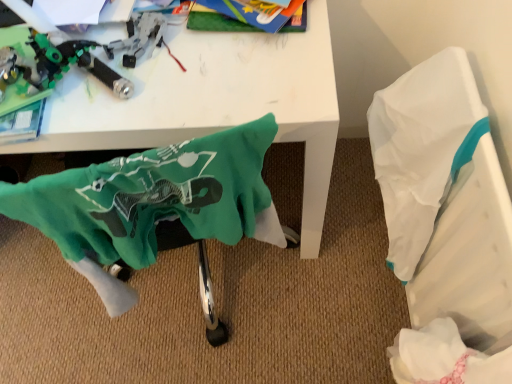
Question: From the image's perspective, is white paper at right located above or below white glossy table at upper center?

Choices:
 (A) below
 (B) above

Answer: (B)

Question: In terms of size, does white paper at right appear bigger or smaller than white glossy table at upper center?

Choices:
 (A) small
 (B) big

Answer: (A)

Question: Considering the real-world distances, which object is closest to the white glossy table at upper center?

Choices:
 (A) white paper at right
 (B) green fabric swivel chair at lower left
 (C) translucent plastic toy gun at upper left

Answer: (C)

Question: Estimate the real-world distances between objects in this image. Which object is farther from the white paper at right?

Choices:
 (A) white glossy table at upper center
 (B) translucent plastic toy gun at upper left
 (C) green fabric swivel chair at lower left

Answer: (B)